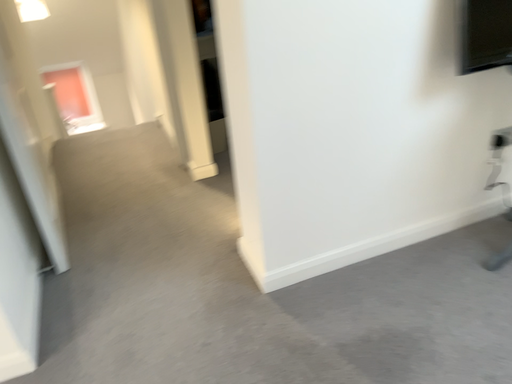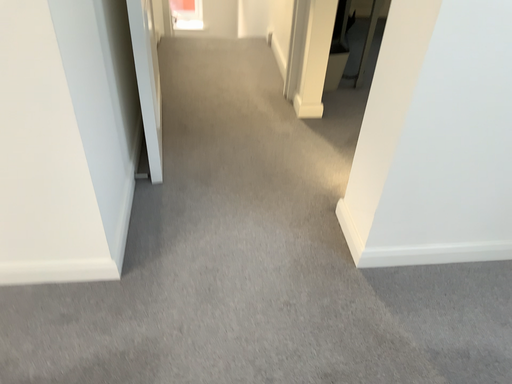
Question: How did the camera likely rotate when shooting the video?

Choices:
 (A) rotated left
 (B) rotated right

Answer: (A)